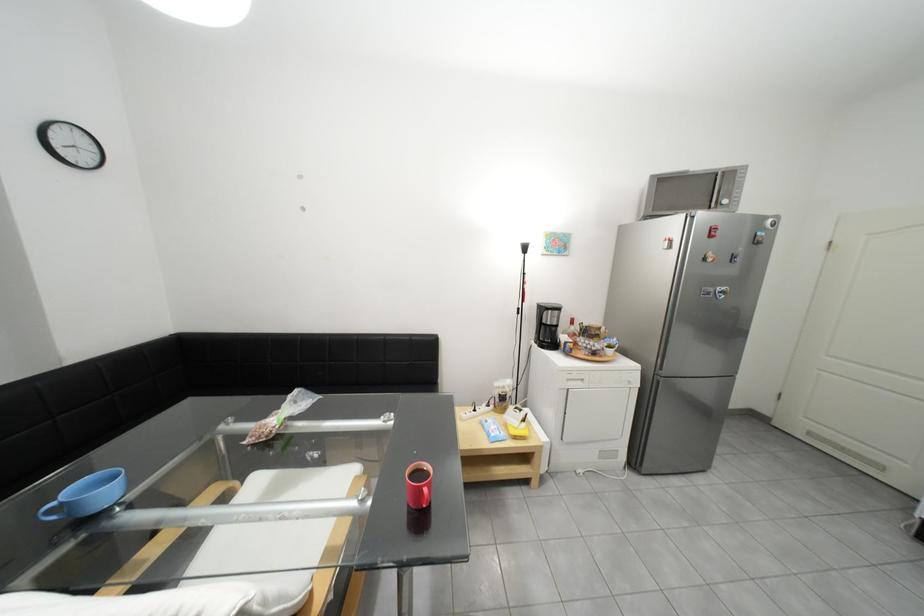
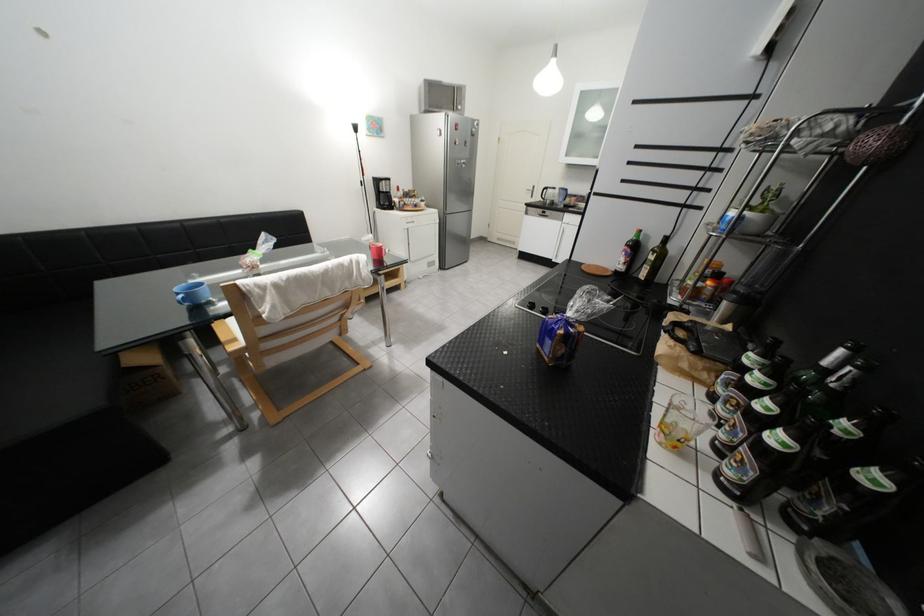
Find the pixel in the second image that matches (554,329) in the first image.

(393, 196)